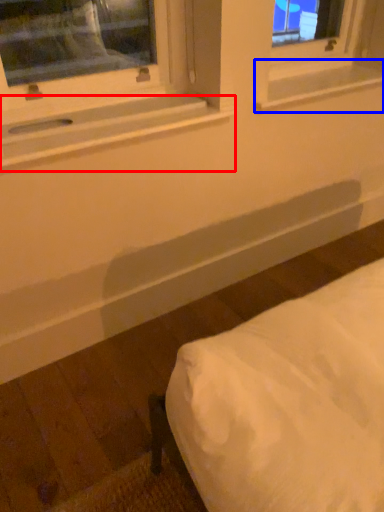
Question: Which point is further to the camera, window sill (highlighted by a red box) or window sill (highlighted by a blue box)?

Choices:
 (A) window sill
 (B) window sill

Answer: (B)